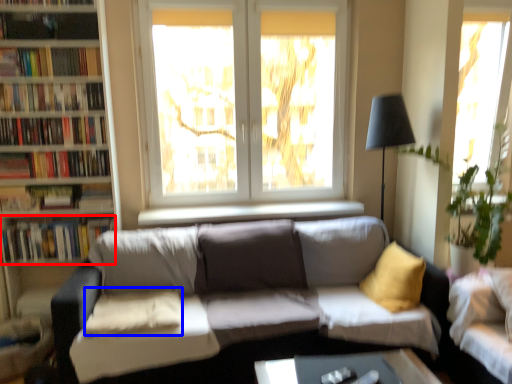
Question: Which object appears farthest to the camera in this image, book (highlighted by a red box) or pillow (highlighted by a blue box)?

Choices:
 (A) book
 (B) pillow

Answer: (A)